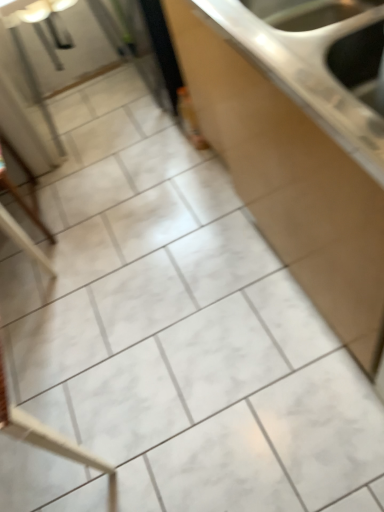
Find the location of a particular element. The height and width of the screenshot is (512, 384). free space in front of wooden chair at left is located at coordinates (53, 274).